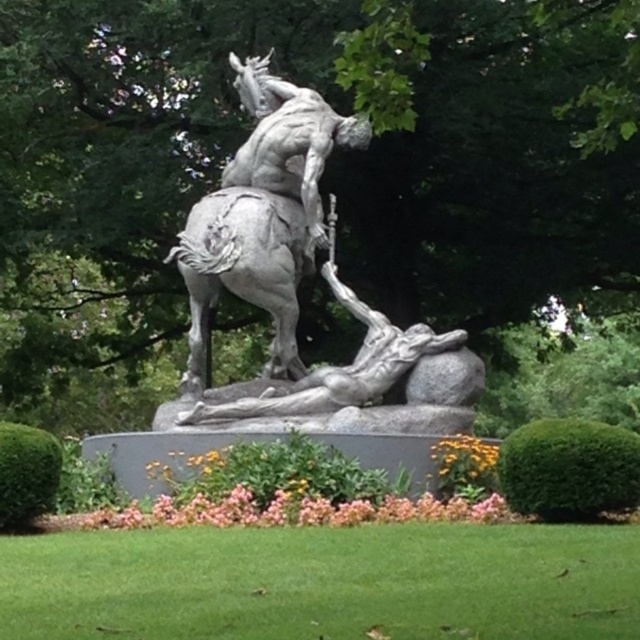
You are an art student analyzing the sculpture. You notice two key figures in the sculpture. Which figure is positioned higher up, the polished bronze statue at center or the polished bronze rider at upper center?

The polished bronze rider at upper center is positioned higher up than the polished bronze statue at center.

You are an art curator planning to display the polished bronze statue at center and the gray stone horse at center in a gallery. The gallery has a narrow corridor that can only accommodate items up to 2 meters wide. Given their widths, which sculpture would you recommend placing in the corridor first to ensure it fits?

The gray stone horse at center has a smaller width compared to the polished bronze statue at center, so it should be placed in the corridor first to ensure it fits within the 2 meters width limit.